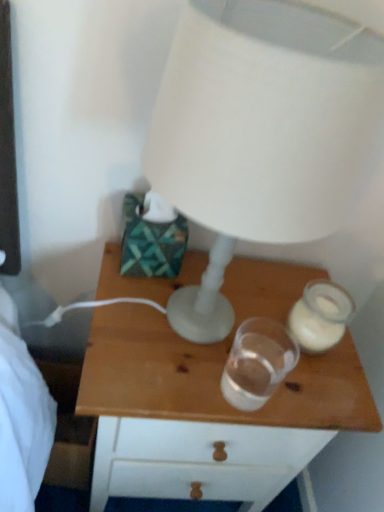
This screenshot has width=384, height=512. I want to click on vacant space to the left of transparent glass at center, positioned as the second candle holder in right-to-left order, so (x=152, y=357).